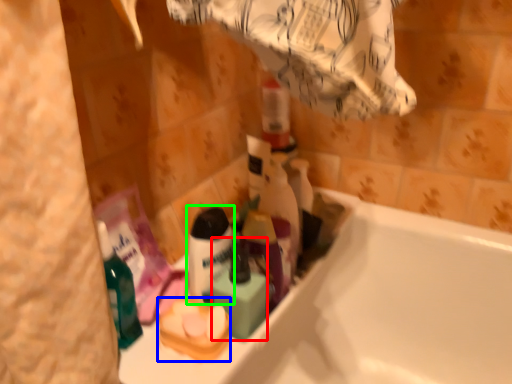
Question: Estimate the real-world distances between objects in this image. Which object is closer to mouthwash (highlighted by a red box), product (highlighted by a blue box) or shaving cream (highlighted by a green box)?

Choices:
 (A) product
 (B) shaving cream

Answer: (B)